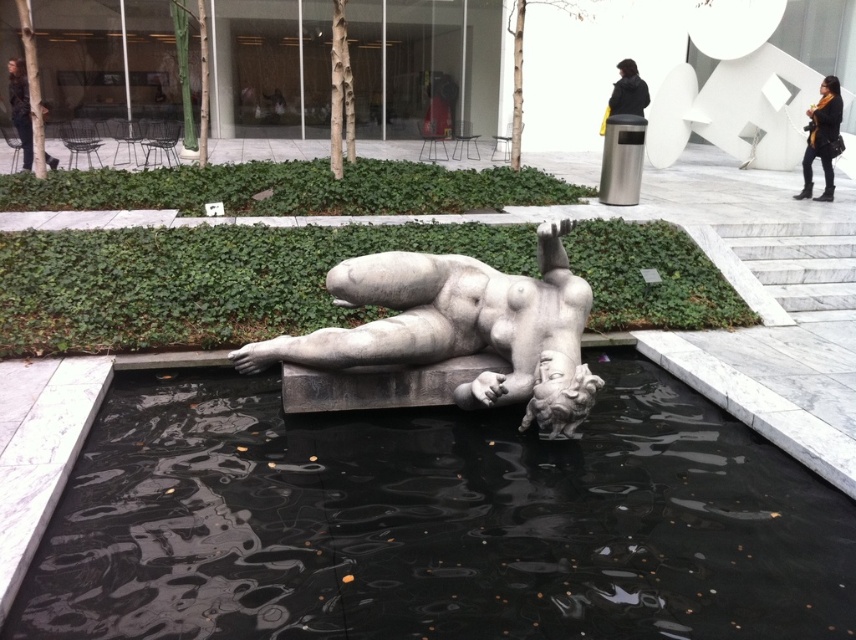
You are standing in the sculpture garden and want to take a photo of both the black polished water at center and the dark woolen coat at upper center. Which object should you focus on first to ensure both are in sharp focus?

You should focus on the dark woolen coat at upper center first because it is farther away from the viewer than the black polished water at center, so adjusting focus from the farther object to the closer one will help both be in sharp focus.

From the picture: You are standing in the sculpture garden and want to take a photo of the large reclining statue. Since the black polished water at center reflects the statue, where should you position yourself to capture the reflection in the water?

To capture the reflection of the large reclining statue in the black polished water at center, you should position yourself directly above the water at point [434,522] as specified in the description.